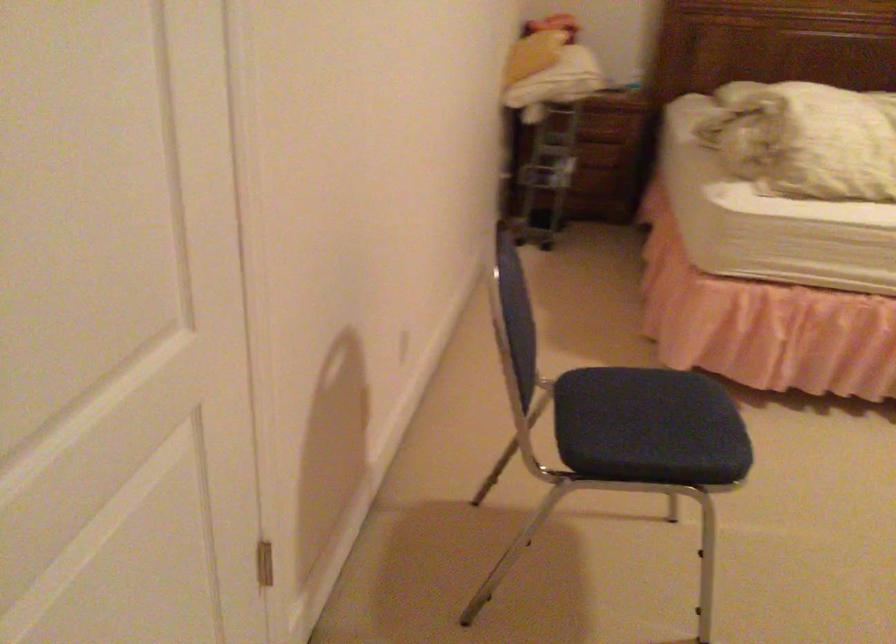
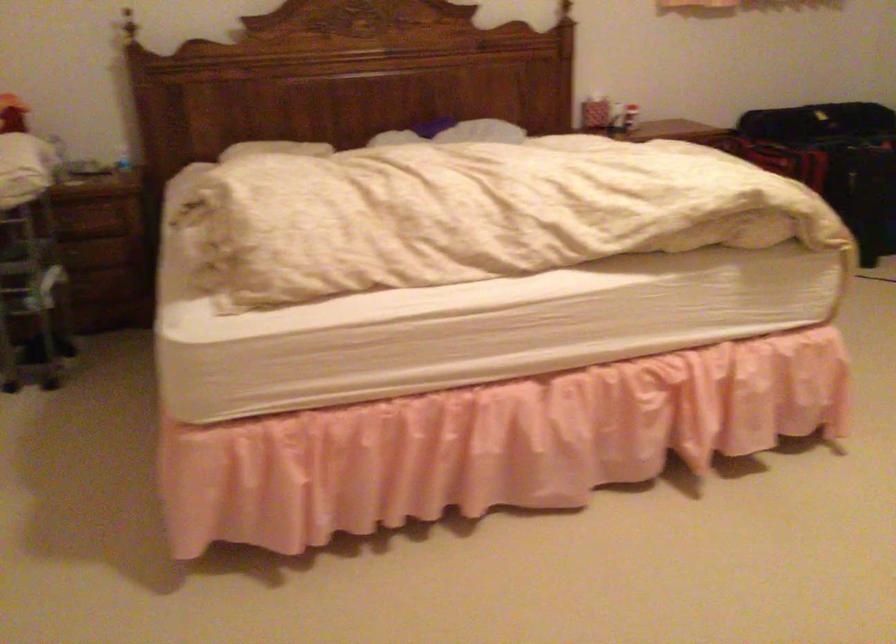
In the scene shown: In a continuous first-person perspective shot, in which direction is the camera moving?

The movement direction of the cameraman is right, forward.